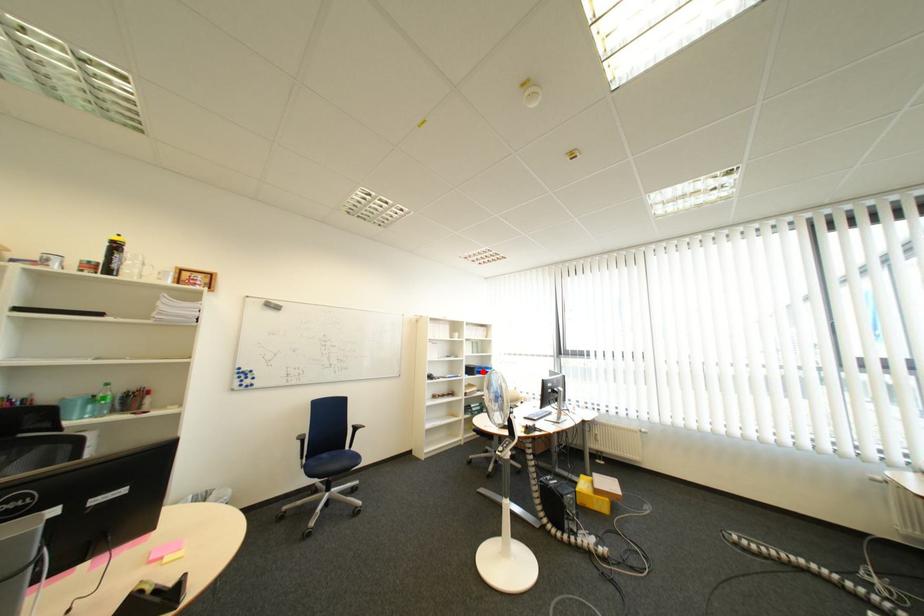
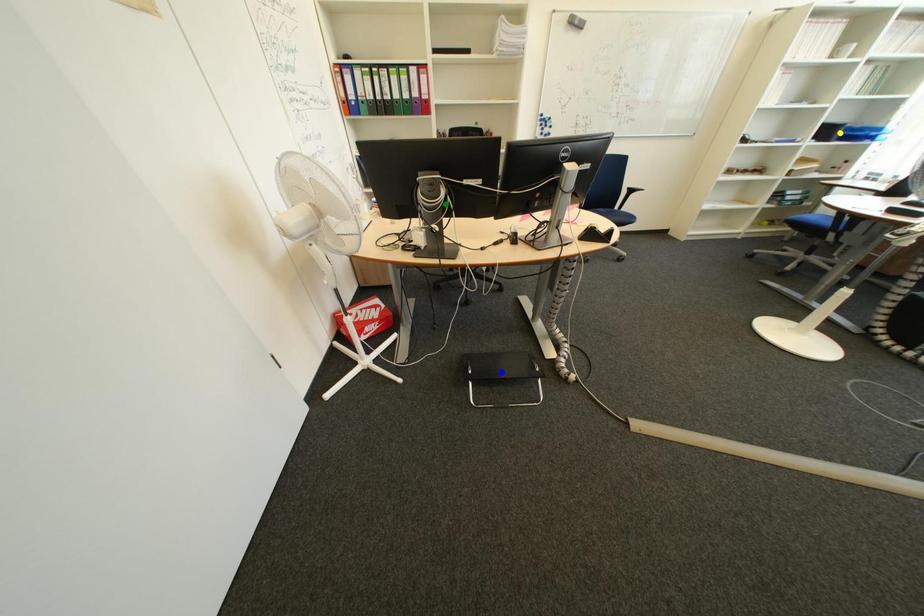
Question: I am providing you with two images of the same scene from different viewpoints. A red point is marked on the first image. You are given multiple points on the second image. Which point in image 2 is actually the same real-world point as the red point in image 1?

Choices:
 (A) green point
 (B) blue point
 (C) yellow point

Answer: (C)